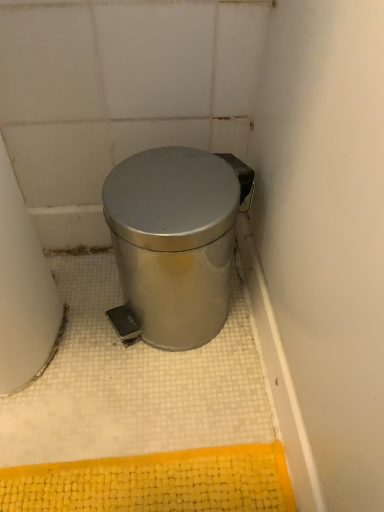
What do you see at coordinates (175, 240) in the screenshot? I see `polished silver trash can at center` at bounding box center [175, 240].

Find the location of a particular element. This screenshot has width=384, height=512. polished silver trash can at center is located at coordinates (175, 240).

Identify the location of polished silver trash can at center. (175, 240).